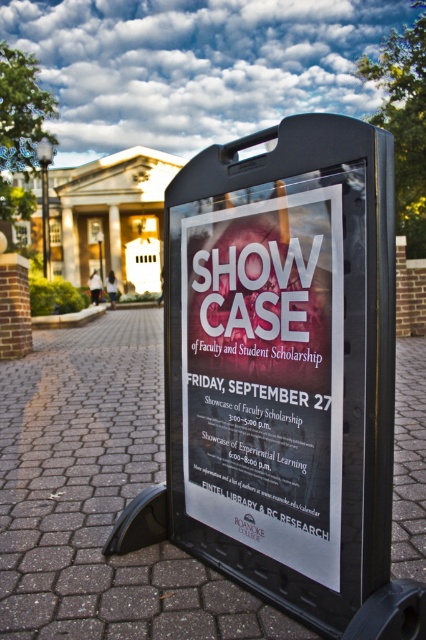
Can you confirm if white paper poster at center is thinner than black plastic sign at center?

Correct, white paper poster at center's width is less than black plastic sign at center's.

Between white paper poster at center and black plastic sign at center, which one is positioned lower?

white paper poster at center

Image resolution: width=426 pixels, height=640 pixels. Describe the element at coordinates (265, 376) in the screenshot. I see `white paper poster at center` at that location.

Identify the location of white paper poster at center. The width and height of the screenshot is (426, 640). (265, 376).

Can you confirm if brown cobblestone pavement at center is wider than white paper poster at center?

Indeed, brown cobblestone pavement at center has a greater width compared to white paper poster at center.

Between brown cobblestone pavement at center and white paper poster at center, which one has less height?

Standing shorter between the two is brown cobblestone pavement at center.

Identify the location of brown cobblestone pavement at center. The width and height of the screenshot is (426, 640). (100, 497).

Identify the location of brown cobblestone pavement at center. The image size is (426, 640). (100, 497).

Between brown cobblestone pavement at center and black plastic sign at center, which one has more height?

Standing taller between the two is black plastic sign at center.

Between brown cobblestone pavement at center and black plastic sign at center, which one appears on the left side from the viewer's perspective?

From the viewer's perspective, black plastic sign at center appears more on the left side.

Locate an element on the screen. The height and width of the screenshot is (640, 426). brown cobblestone pavement at center is located at coordinates (100, 497).

The height and width of the screenshot is (640, 426). Find the location of `brown cobblestone pavement at center`. brown cobblestone pavement at center is located at coordinates (100, 497).